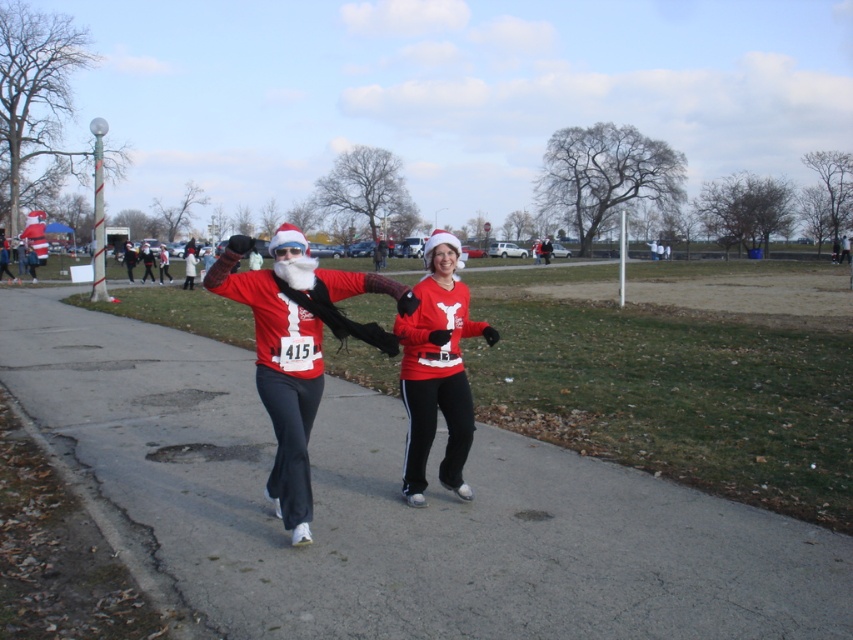
You are a photographer at the Christmas race and want to capture both the matte red santa suit at center and the matte red sweater at center in a single frame. Which one should you focus on first if you want to include both in your shot?

The matte red santa suit at center is positioned on the left side of the matte red sweater at center, so focusing on the matte red sweater at center first would allow you to frame both objects since it is on the right side.

You are a delivery drone that needs to fly over the smooth asphalt road at center and the matte red sweater at center. The drone has a minimum required clearance of 1 meter to safely pass over objects. Given their sizes, can the drone safely navigate over both objects?

The smooth asphalt road at center has a larger width than the matte red sweater at center. Since the drone requires at least 1 meter of clearance, it can safely navigate over both objects as long as the width of the road and the sweater allows for the necessary space. However, without specific measurements, we cannot confirm if the sweater is under 1 meter in width. The asphalt road is wider, so it likely provides sufficient clearance.

You are a drone operator trying to capture aerial footage of the festive race. Your drone is currently hovering above the smooth asphalt road at center and the matte red sweater at center. Which object is lower in height from the drone perspective?

The smooth asphalt road at center has a lesser height compared to matte red sweater at center, so the smooth asphalt road at center is lower in height from the drone perspective.